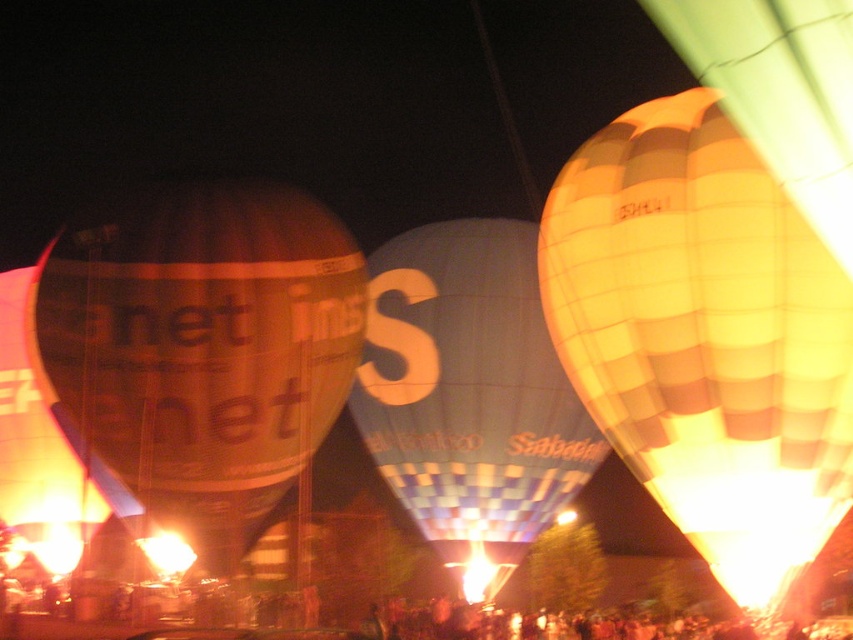
In order to click on yellow checkered balloon at right in this screenshot , I will do `click(705, 337)`.

Can you confirm if yellow checkered balloon at right is positioned to the right of blue checkered fabric balloon at center?

Correct, you'll find yellow checkered balloon at right to the right of blue checkered fabric balloon at center.

Between point (711, 141) and point (433, 292), which one is positioned in front?

Positioned in front is point (711, 141).

The width and height of the screenshot is (853, 640). I want to click on yellow checkered balloon at right, so click(705, 337).

Is point (350, 236) less distant than point (462, 230)?

Yes, point (350, 236) is closer to viewer.

Based on the photo, can you confirm if translucent orange balloon at left is positioned above blue checkered fabric balloon at center?

Yes.

Find the location of a particular element. The width and height of the screenshot is (853, 640). translucent orange balloon at left is located at coordinates (198, 349).

Which of these two, yellow checkered balloon at right or translucent orange balloon at left, stands shorter?

translucent orange balloon at left

Can you confirm if yellow checkered balloon at right is bigger than translucent orange balloon at left?

Indeed, yellow checkered balloon at right has a larger size compared to translucent orange balloon at left.

This screenshot has width=853, height=640. Find the location of `yellow checkered balloon at right`. yellow checkered balloon at right is located at coordinates 705,337.